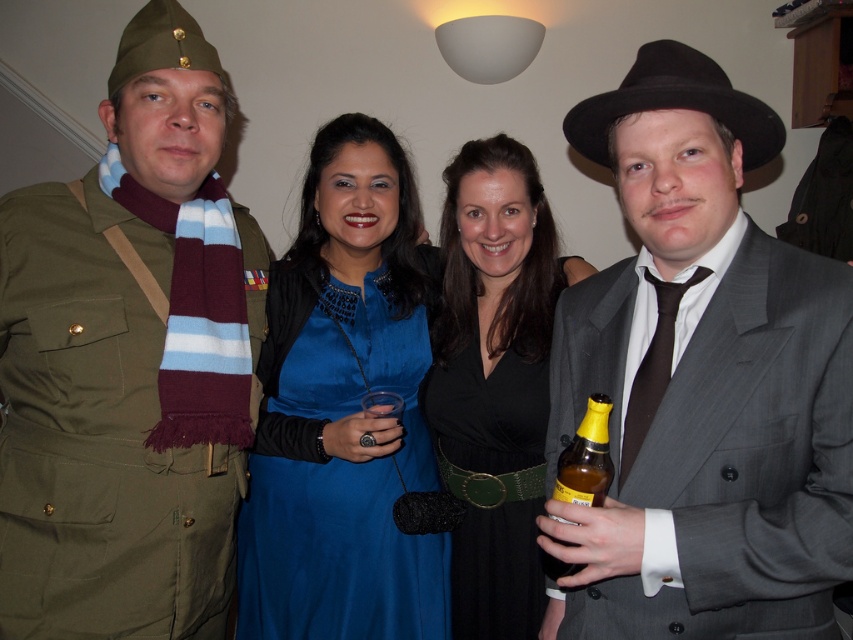
Who is lower down, matte gray suit at center or black satin dress at center?

black satin dress at center is below.

Between matte gray suit at center and black satin dress at center, which one appears on the left side from the viewer's perspective?

From the viewer's perspective, black satin dress at center appears more on the left side.

This screenshot has width=853, height=640. Find the location of `matte gray suit at center`. matte gray suit at center is located at coordinates (701, 381).

Is point (28, 257) positioned before point (375, 608)?

Yes, it is.

Which is more to the left, matte olive green uniform at left or satin blue dress at center?

matte olive green uniform at left

At what (x,y) coordinates should I click in order to perform the action: click on matte olive green uniform at left. Please return your answer as a coordinate pair (x, y). Looking at the image, I should click on (126, 362).

Is matte gray suit at center bigger than satin blue dress at center?

Indeed, matte gray suit at center has a larger size compared to satin blue dress at center.

Does matte gray suit at center have a greater width compared to satin blue dress at center?

No, matte gray suit at center is not wider than satin blue dress at center.

Between point (548, 468) and point (350, 561), which one is positioned in front?

Point (548, 468) is more forward.

Identify the location of matte gray suit at center. Image resolution: width=853 pixels, height=640 pixels. (701, 381).